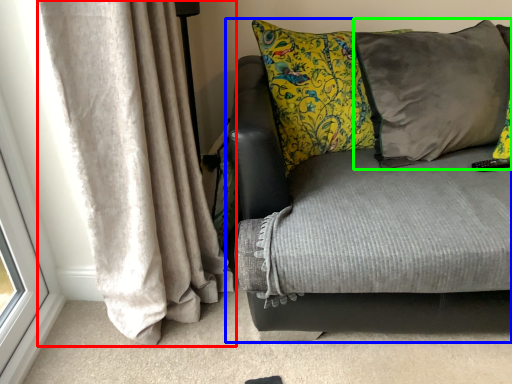
Question: Estimate the real-world distances between objects in this image. Which object is farther from curtain (highlighted by a red box), studio couch (highlighted by a blue box) or pillow (highlighted by a green box)?

Choices:
 (A) studio couch
 (B) pillow

Answer: (B)